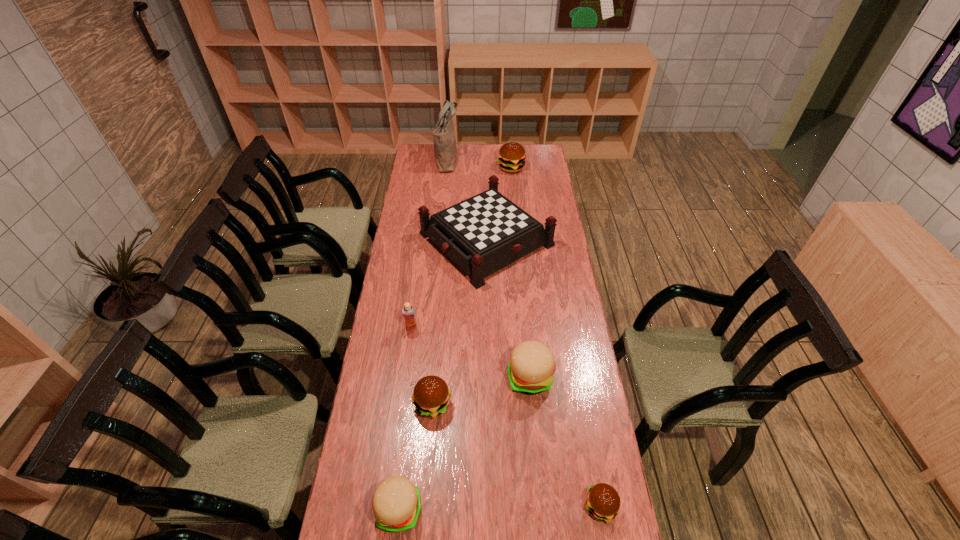
Identify the location of free space that satisfies the following two spatial constraints: 1. on the front-facing side of the second smallest brown hamburger; 2. on the left side of the tallest object. (424, 404).

Find the location of a particular element. free location that satisfies the following two spatial constraints: 1. on the front-facing side of the tallest object; 2. on the left side of the checkerboard is located at coordinates (440, 239).

Locate an element on the screen. free location that satisfies the following two spatial constraints: 1. on the back side of the checkerboard; 2. on the front-facing side of the shoulder bag is located at coordinates (485, 159).